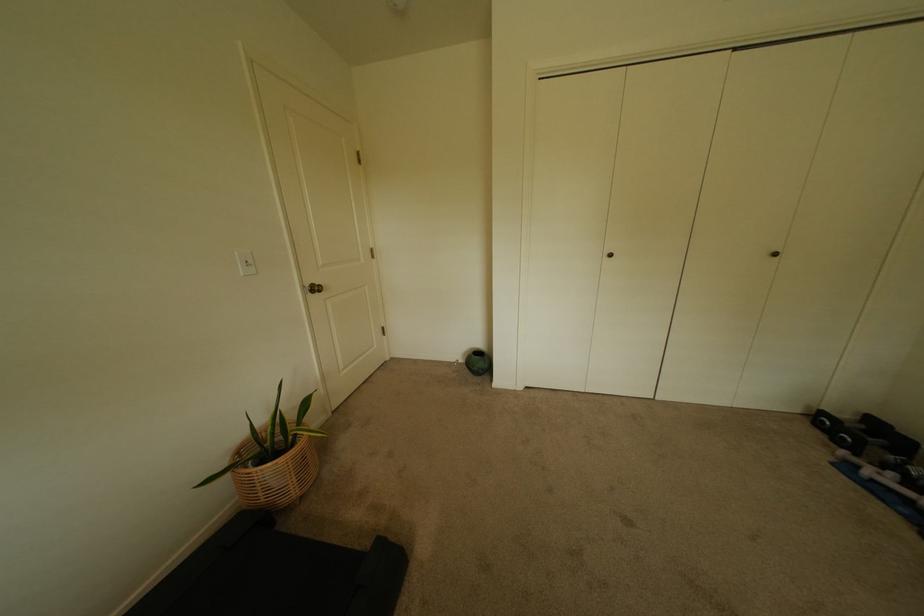
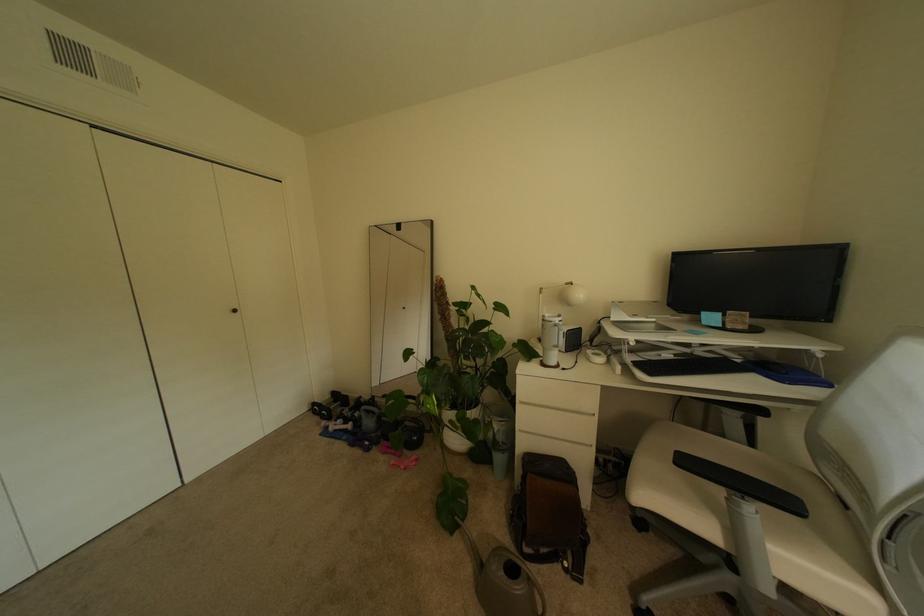
Question: The images are taken continuously from a first-person perspective. In which direction is your viewpoint rotating?

Choices:
 (A) Left
 (B) Right
 (C) Up
 (D) Down

Answer: (B)